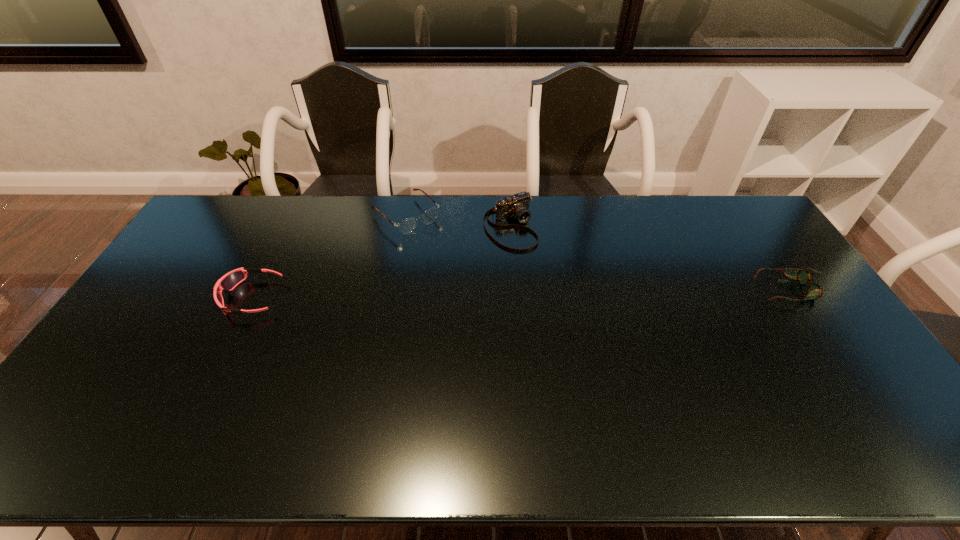
The width and height of the screenshot is (960, 540). Find the location of `object present at the right edge`. object present at the right edge is located at coordinates (815, 291).

This screenshot has width=960, height=540. What are the coordinates of `vacant region at the far edge of the desktop` in the screenshot? It's located at (384, 222).

This screenshot has width=960, height=540. I want to click on vacant space at the near edge of the desktop, so click(471, 401).

The height and width of the screenshot is (540, 960). In order to click on vacant space at the left edge of the desktop in this screenshot , I will do `click(187, 279)`.

You are a GUI agent. You are given a task and a screenshot of the screen. Output one action in this format:
    pyautogui.click(x=<x>, y=<y>)
    Task: Click on the free space at the right edge of the desktop
    This screenshot has height=540, width=960.
    Given the screenshot: What is the action you would take?
    pyautogui.click(x=777, y=312)

Where is `free location at the far left corner`? free location at the far left corner is located at coordinates (229, 225).

In the image, there is a desktop. Where is `vacant space at the near left corner`? This screenshot has height=540, width=960. vacant space at the near left corner is located at coordinates click(x=127, y=406).

At what (x,y) coordinates should I click in order to perform the action: click on vacant space at the far right corner of the desktop. Please return your answer as a coordinate pair (x, y). Looking at the image, I should click on (753, 222).

Find the location of a particular element. vacant area at the near right corner of the desktop is located at coordinates (871, 411).

Find the location of a particular element. free space between the tallest object and the shorter spectacles is located at coordinates (651, 258).